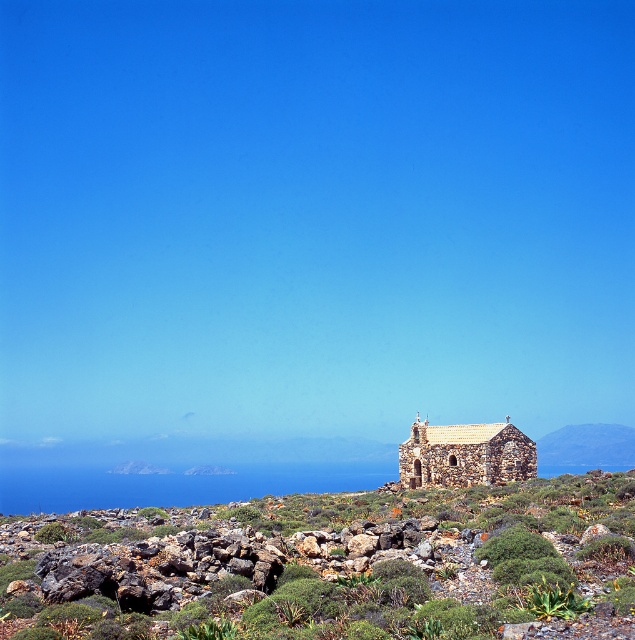
You are a photographer standing at the edge of the coastal landscape. You want to capture a photo of the green mossy rocks at center from a distance of exactly 60 meters. Based on the scene description, can you position yourself close enough to achieve this?

The green mossy rocks at center are located 61.54 meters away from the camera. Since 61.54 meters is slightly more than 60 meters, you cannot position yourself close enough to capture the photo from exactly 60 meters away.

Consider the image. You are standing at the base of the stone chapel in the coastal landscape. You notice two points marked on the ground in front of you. The first point is at coordinates point (128, 522) and the second is at point (401, 442). If you were to walk towards the sea, which point would you encounter first?

The point at coordinates point (128, 522) is in front of point (401, 442), so you would encounter point (128, 522) first as you walk towards the sea.

You are a tourist standing in front of the stone textured church at center and the green mossy rocks at center. Which object is taller?

The stone textured church at center is taller than the green mossy rocks at center.